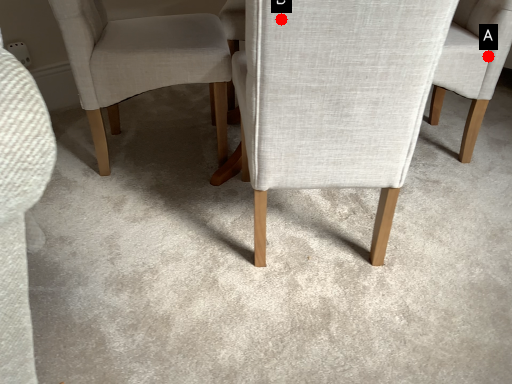
Question: Two points are circled on the image, labeled by A and B beside each circle. Which point appears farthest from the camera in this image?

Choices:
 (A) A is further
 (B) B is further

Answer: (A)